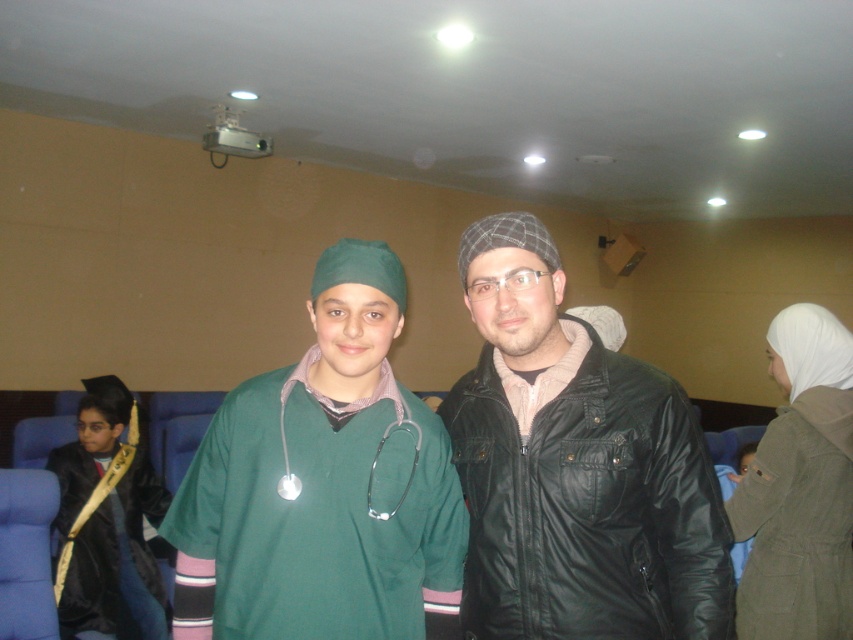
Based on the photo, you are organizing a school event and need to seat two guests who will be sitting side by side. The guests are wearing the green matte scrub at center and the black satin graduation gown at lower left. Based on their clothing width, which guest should you place on the side with more space to ensure comfort?

The green matte scrub at center might be wider than black satin graduation gown at lower left, so the guest wearing the green matte scrub at center should be placed on the side with more space to accommodate their wider clothing.